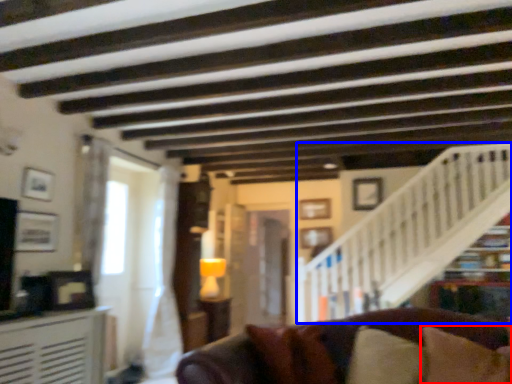
Question: Which point is further to the camera, pillow (highlighted by a red box) or stairwell (highlighted by a blue box)?

Choices:
 (A) pillow
 (B) stairwell

Answer: (B)